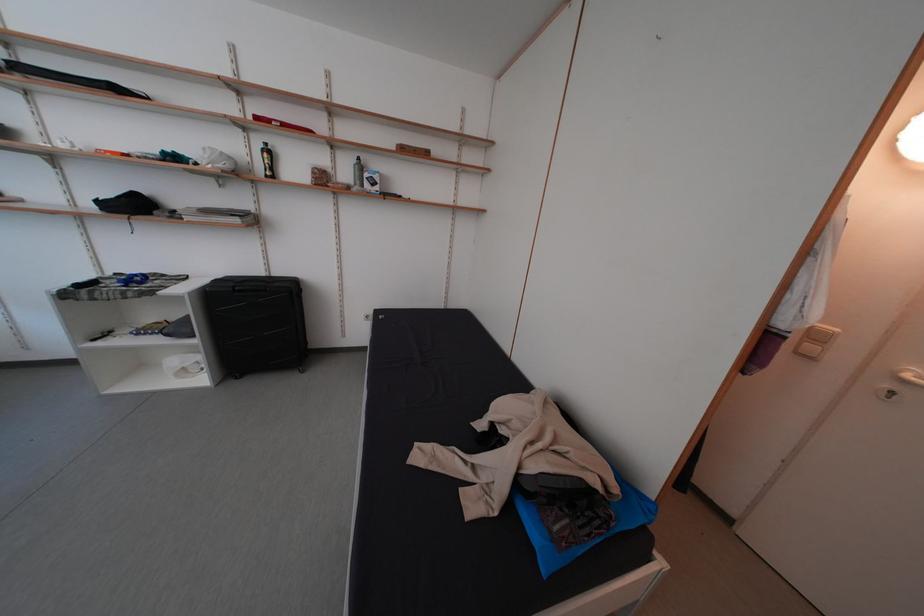
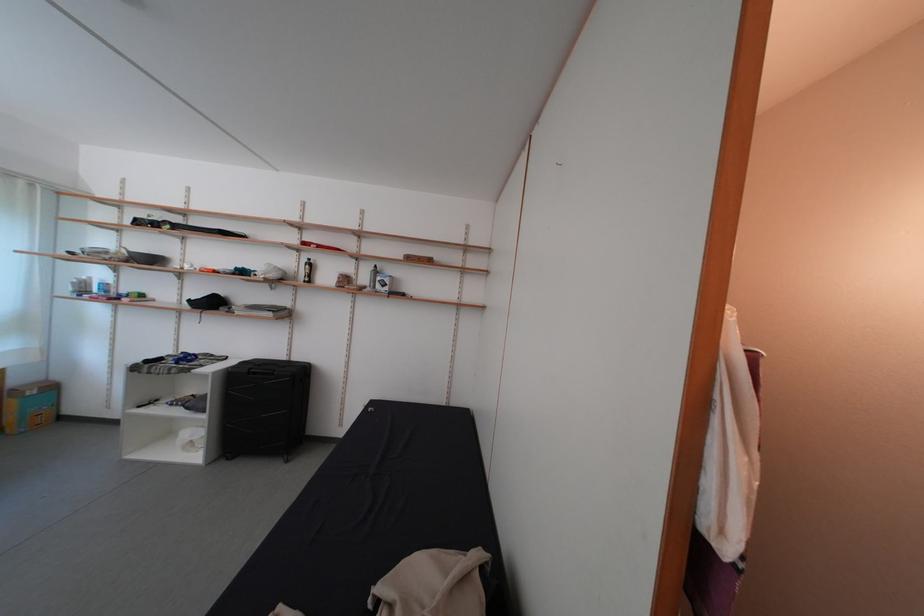
Question: What movement of the cameraman would produce the second image?

Choices:
 (A) Left
 (B) Right
 (C) Forward
 (D) Backward

Answer: (B)